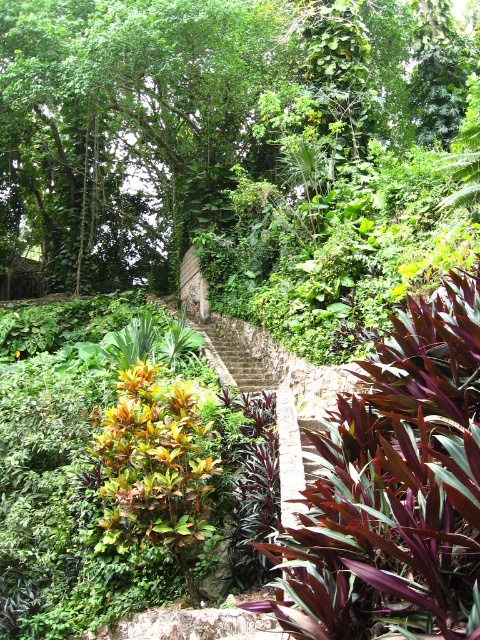
Question: Among these objects, which one is farthest from the camera?

Choices:
 (A) purple leathery leaves at center
 (B) green leafy tree at upper center

Answer: (B)

Question: Is green leafy tree at upper center smaller than purple leathery leaves at center?

Choices:
 (A) yes
 (B) no

Answer: (B)

Question: Is green leafy tree at upper center thinner than purple leathery leaves at center?

Choices:
 (A) no
 (B) yes

Answer: (A)

Question: Which point is closer to the camera?

Choices:
 (A) (322, 38)
 (B) (370, 524)

Answer: (B)

Question: Is green leafy tree at upper center above purple leathery leaves at center?

Choices:
 (A) no
 (B) yes

Answer: (B)